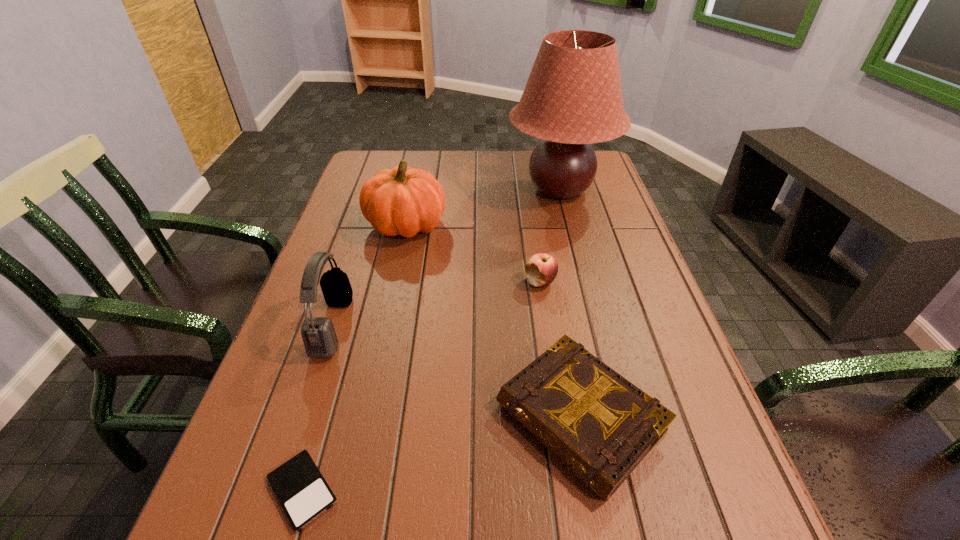
In the image, there is a desktop. Where is `vacant space at the far edge`? This screenshot has height=540, width=960. vacant space at the far edge is located at coordinates pos(476,170).

The height and width of the screenshot is (540, 960). In the image, there is a desktop. Identify the location of vacant space at the left edge. (276, 433).

Where is `vacant space at the right edge of the desktop`? This screenshot has height=540, width=960. vacant space at the right edge of the desktop is located at coordinates (634, 343).

The width and height of the screenshot is (960, 540). In the image, there is a desktop. Identify the location of vacant space at the far left corner. (400, 152).

Identify the location of blank region between the shortest object and the headset. This screenshot has height=540, width=960. (318, 408).

The image size is (960, 540). In order to click on vacant area between the pumpkin and the hardback book in this screenshot , I will do `click(492, 322)`.

The width and height of the screenshot is (960, 540). I want to click on vacant point located between the hardback book and the pumpkin, so click(492, 322).

This screenshot has height=540, width=960. What are the coordinates of `vacant space that's between the headset and the hardback book` in the screenshot? It's located at (457, 372).

The width and height of the screenshot is (960, 540). Find the location of `free space between the headset and the pumpkin`. free space between the headset and the pumpkin is located at coordinates click(370, 275).

Find the location of a particular element. This screenshot has width=960, height=540. free space between the apple and the shortest object is located at coordinates (421, 386).